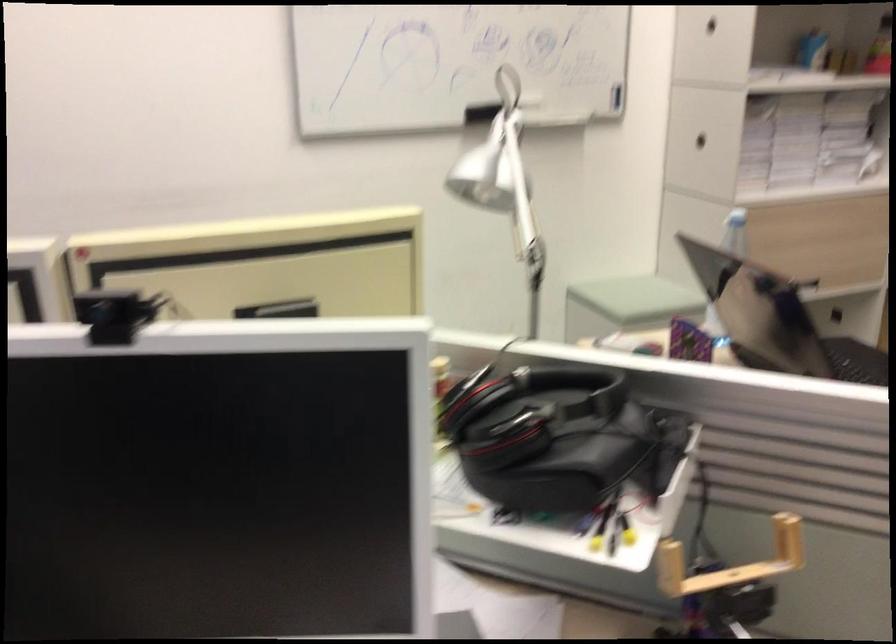
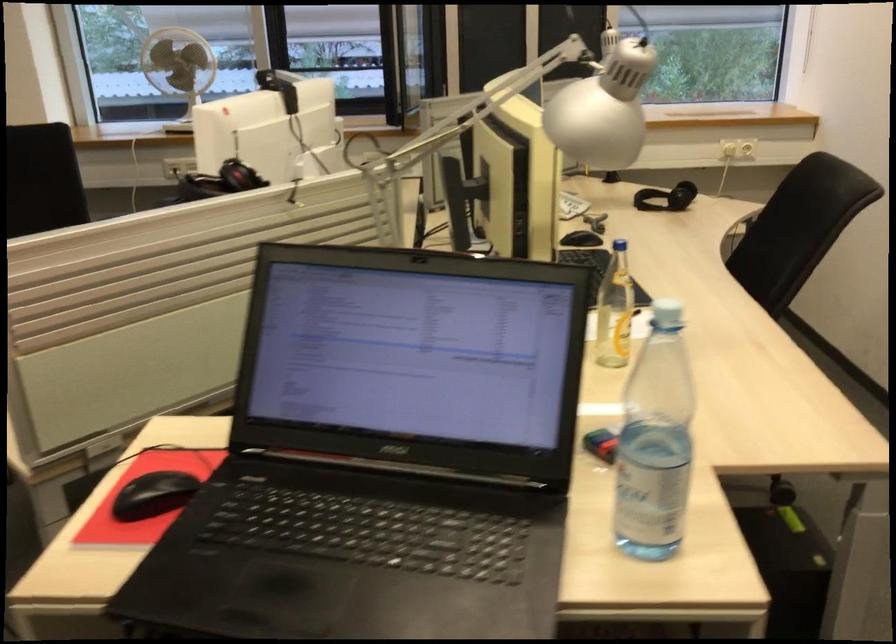
The point at [476,166] is marked in the first image. Where is the corresponding point in the second image?

(604, 109)